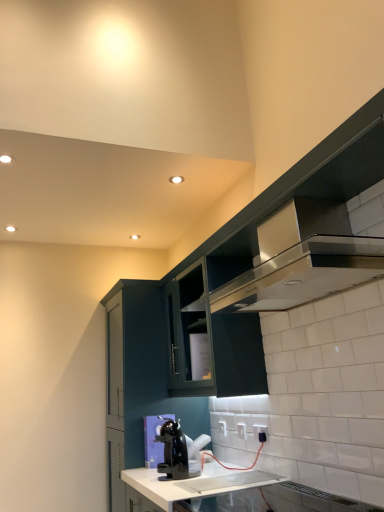
The height and width of the screenshot is (512, 384). I want to click on vacant area situated below black plastic coffee maker at lower center (from a real-world perspective), so click(x=178, y=477).